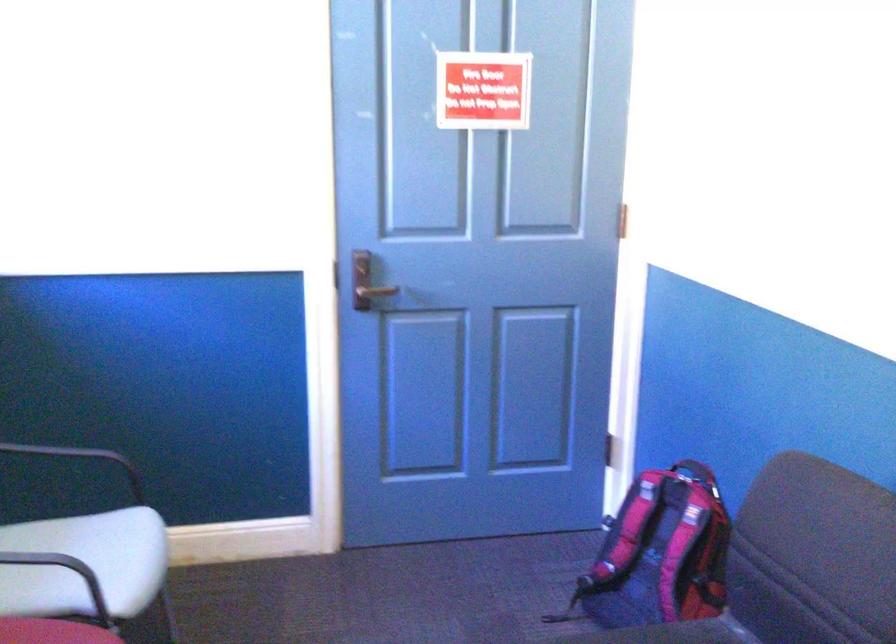
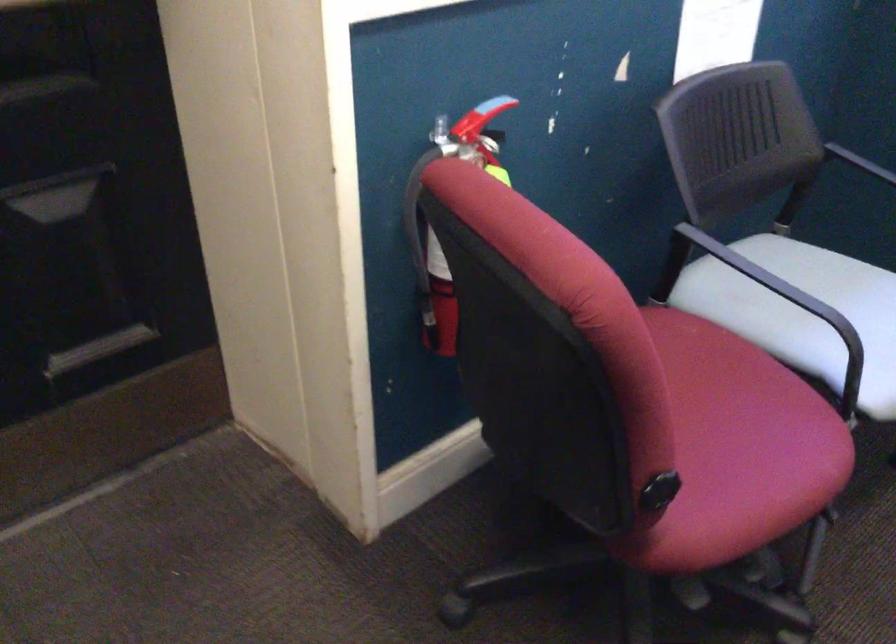
From the picture: Based on the continuous images, in which direction is the camera rotating?

The rotation direction of the camera is left-down.